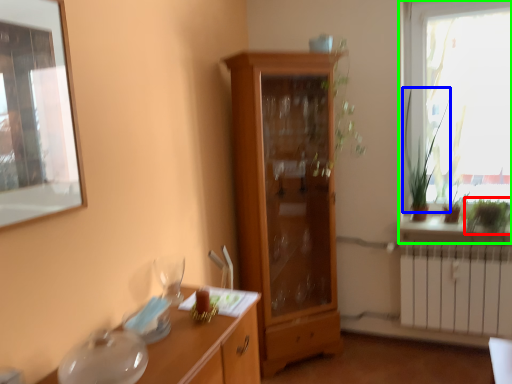
Question: Which object is positioned closest to plant (highlighted by a red box)? Select from plant (highlighted by a blue box) and window (highlighted by a green box).

Choices:
 (A) plant
 (B) window

Answer: (A)